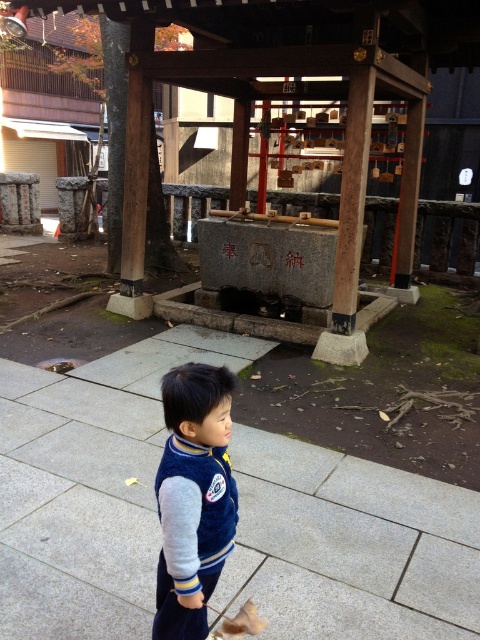
Question: Does gray concrete pavement at center have a lesser width compared to velvet blue jacket at center?

Choices:
 (A) yes
 (B) no

Answer: (B)

Question: Can you confirm if gray concrete pavement at center is smaller than velvet blue jacket at center?

Choices:
 (A) yes
 (B) no

Answer: (B)

Question: Is gray concrete pavement at center smaller than velvet blue jacket at center?

Choices:
 (A) no
 (B) yes

Answer: (A)

Question: Which of the following is the farthest from the observer?

Choices:
 (A) (167, 637)
 (B) (369, 522)

Answer: (B)

Question: Which point is farther from the camera taking this photo?

Choices:
 (A) (316, 582)
 (B) (184, 600)

Answer: (A)